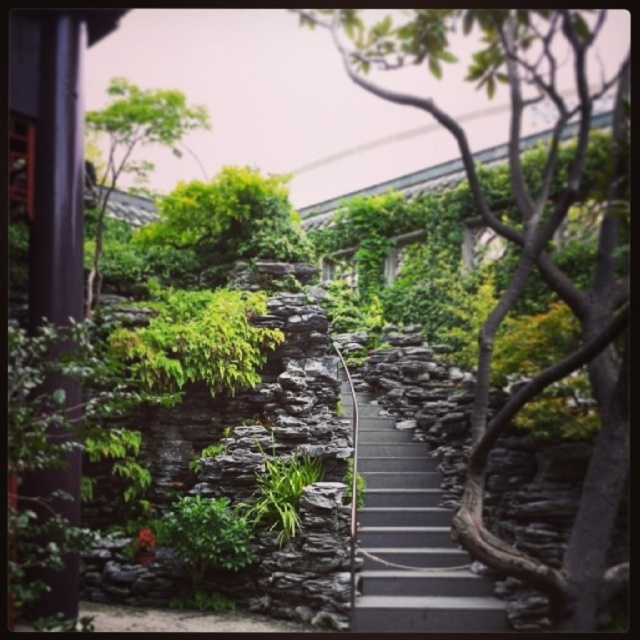
You are standing at the bottom of the garden pathway and want to reach the green leafy tree at upper left. The dark gray stone stairs at center are in your way. Can you walk around them to get to the tree?

The dark gray stone stairs at center are closer to you than the green leafy tree at upper left, so you can walk around them to reach the tree.